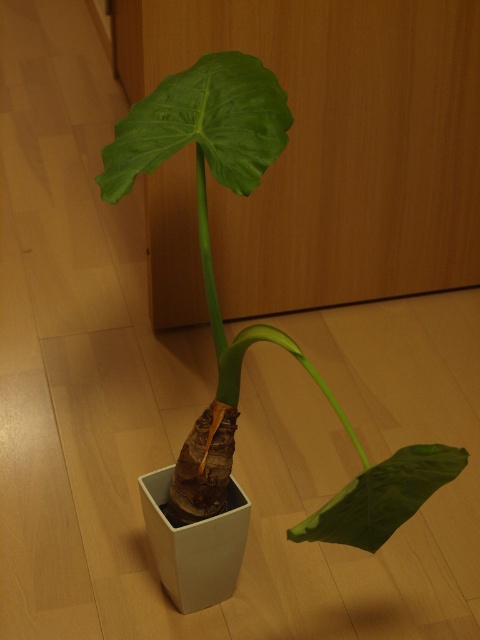
You are a gardener who wants to prune the leaves of the Alocasia plant. You notice two leaves, the green matte leaf at upper center and the green matte leaf at lower right. Which leaf should you prune if you want to remove the taller one?

The green matte leaf at upper center has a greater height compared to the green matte leaf at lower right, so you should prune the green matte leaf at upper center.

From the picture: You are a gardener who needs to water the green matte leaf at center. You have a watering can that sprays water up to 1 meter. Can you reach the leaf without moving closer?

The green matte leaf at center is 1.01 meters away from the viewer. Since the watering can can only spray up to 1 meter, you cannot reach the leaf without moving closer.

Based on the photo, you are standing in the room and see the potted plant. There is a point marked at coordinates (259,323). What object is located at that point?

The point at coordinates (259,323) marks the green matte leaf at center.